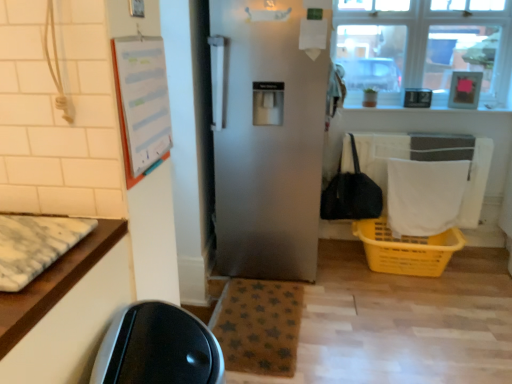
Question: Is white marble mat at left, which ranks as the first mat in left-to-right order, positioned in front of white fabric laundry at lower right?

Choices:
 (A) yes
 (B) no

Answer: (A)

Question: Does white marble mat at left, which ranks as the first mat in left-to-right order, have a lesser width compared to white fabric laundry at lower right?

Choices:
 (A) yes
 (B) no

Answer: (B)

Question: Is white marble mat at left, the second mat viewed from the back, smaller than white fabric laundry at lower right?

Choices:
 (A) yes
 (B) no

Answer: (A)

Question: From the image's perspective, is white marble mat at left, arranged as the 1th mat when viewed from the top, below white fabric laundry at lower right?

Choices:
 (A) no
 (B) yes

Answer: (B)

Question: From the image's perspective, does white marble mat at left, arranged as the 1th mat when viewed from the top, appear higher than white fabric laundry at lower right?

Choices:
 (A) yes
 (B) no

Answer: (B)

Question: Considering the relative positions of yellow plastic basket at lower right and white paperboard at upper left in the image provided, is yellow plastic basket at lower right to the left or to the right of white paperboard at upper left?

Choices:
 (A) right
 (B) left

Answer: (A)

Question: From the image's perspective, is yellow plastic basket at lower right above or below white paperboard at upper left?

Choices:
 (A) above
 (B) below

Answer: (B)

Question: Looking at the image, does yellow plastic basket at lower right seem bigger or smaller compared to white paperboard at upper left?

Choices:
 (A) big
 (B) small

Answer: (A)

Question: From a real-world perspective, is yellow plastic basket at lower right positioned above or below white paperboard at upper left?

Choices:
 (A) below
 (B) above

Answer: (A)

Question: Considering the positions of white paperboard at upper left and black fabric handbag at right in the image, is white paperboard at upper left wider or thinner than black fabric handbag at right?

Choices:
 (A) wide
 (B) thin

Answer: (B)

Question: Relative to black fabric handbag at right, is white paperboard at upper left in front or behind?

Choices:
 (A) front
 (B) behind

Answer: (A)

Question: From the image's perspective, is white paperboard at upper left located above or below black fabric handbag at right?

Choices:
 (A) below
 (B) above

Answer: (B)

Question: In terms of size, does white paperboard at upper left appear bigger or smaller than black fabric handbag at right?

Choices:
 (A) big
 (B) small

Answer: (B)

Question: Considering the relative positions of clear glass window at upper right and black fabric handbag at right in the image provided, is clear glass window at upper right to the left or to the right of black fabric handbag at right?

Choices:
 (A) left
 (B) right

Answer: (B)

Question: Is clear glass window at upper right taller or shorter than black fabric handbag at right?

Choices:
 (A) short
 (B) tall

Answer: (B)